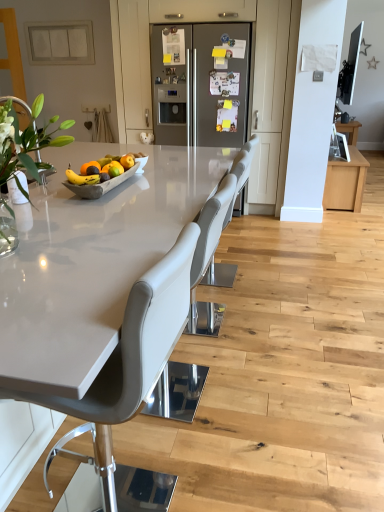
Where is `vacant area that lies to the right of matte gray chair at center, which is the third chair in back-to-front order`? The image size is (384, 512). vacant area that lies to the right of matte gray chair at center, which is the third chair in back-to-front order is located at coordinates (233, 468).